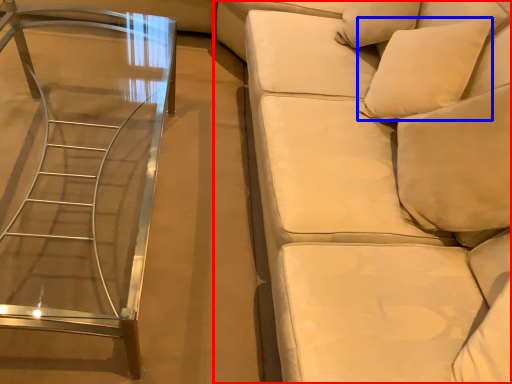
Question: Which object is further to the camera taking this photo, studio couch (highlighted by a red box) or pillow (highlighted by a blue box)?

Choices:
 (A) studio couch
 (B) pillow

Answer: (B)